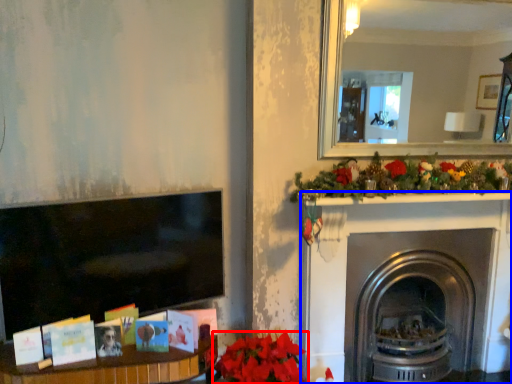
Question: Which point is further to the camera, flower (highlighted by a red box) or fireplace (highlighted by a blue box)?

Choices:
 (A) flower
 (B) fireplace

Answer: (B)